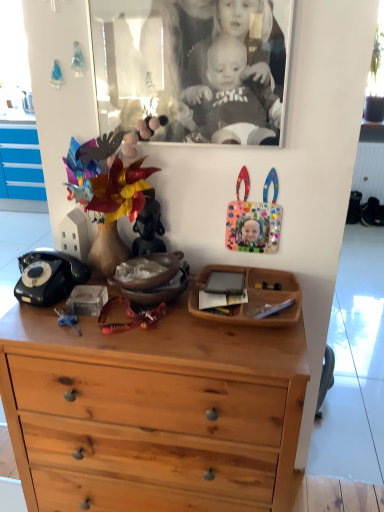
The width and height of the screenshot is (384, 512). Find the location of `vacant region above light brown wood chest of drawers at center (from a real-world perspective)`. vacant region above light brown wood chest of drawers at center (from a real-world perspective) is located at coordinates (144, 316).